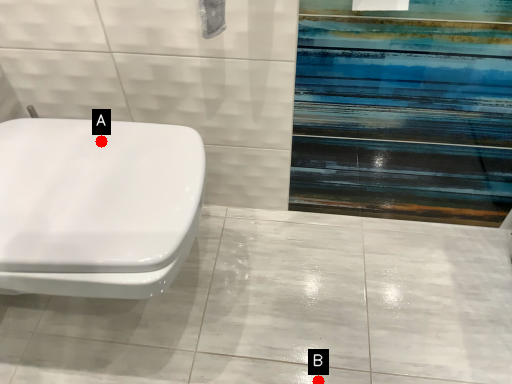
Question: Two points are circled on the image, labeled by A and B beside each circle. Among these points, which one is nearest to the camera?

Choices:
 (A) A is closer
 (B) B is closer

Answer: (A)